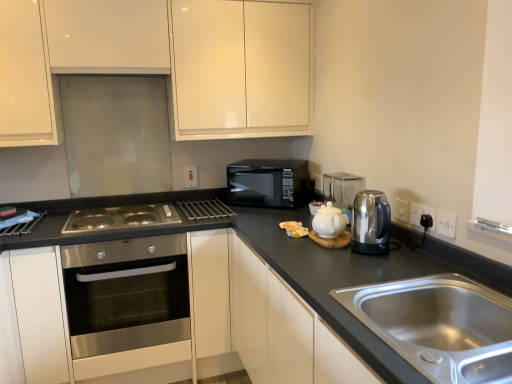
Where is `free spot to the right of satin metallic kettle at right, marked as the first appliance in a front-to-back arrangement`? free spot to the right of satin metallic kettle at right, marked as the first appliance in a front-to-back arrangement is located at coordinates (410, 260).